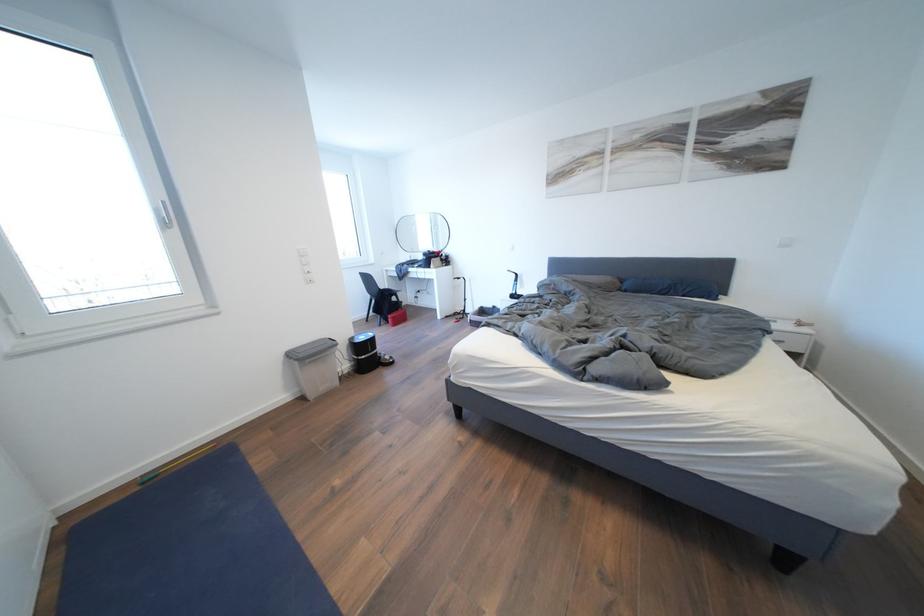
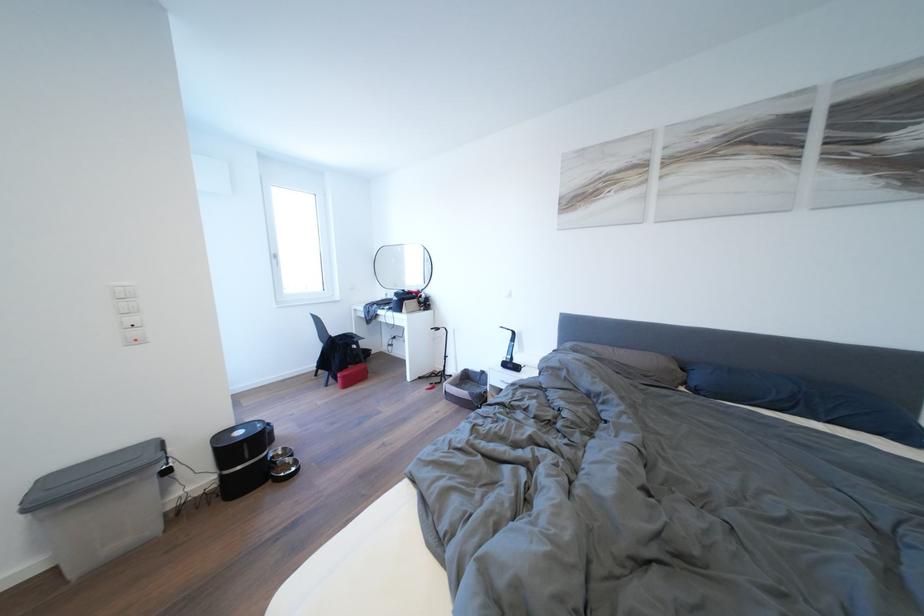
In the second image, find the point that corresponds to pixel 370 342 in the first image.

(248, 438)